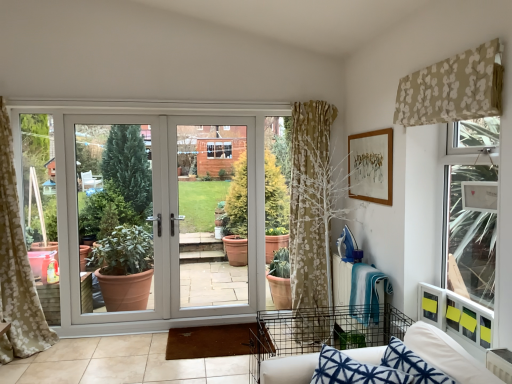
Identify the location of white plastic door at center. This screenshot has width=512, height=384. (163, 214).

What do you see at coordinates (452, 89) in the screenshot?
I see `beige floral fabric at upper right` at bounding box center [452, 89].

Where is `white glossy door at center`? The height and width of the screenshot is (384, 512). white glossy door at center is located at coordinates (211, 215).

Is point (451, 65) in front of point (103, 213)?

That is True.

Looking at this image, considering the sizes of beige floral fabric at upper right and white plastic door at center in the image, is beige floral fabric at upper right taller or shorter than white plastic door at center?

Considering their sizes, beige floral fabric at upper right has less height than white plastic door at center.

Looking at this image, is beige floral fabric at upper right to the left or to the right of white plastic door at center in the image?

Clearly, beige floral fabric at upper right is on the right of white plastic door at center in the image.

Between beige floral fabric at upper right and white plastic door at center, which one is positioned behind?

white plastic door at center is further away from the camera.

Are white glossy door at center and beige floral fabric at upper right beside each other?

No, white glossy door at center is not next to beige floral fabric at upper right.

How many degrees apart are the facing directions of white glossy door at center and beige floral fabric at upper right?

The facing directions of white glossy door at center and beige floral fabric at upper right are 89.2 degrees apart.

Between white glossy door at center and beige floral fabric at upper right, which one has larger size?

white glossy door at center.

From a real-world perspective, is white glossy door at center located higher than beige floral fabric at upper right?

No, from a real-world perspective, white glossy door at center is not above beige floral fabric at upper right.

From the picture: What's the angular difference between white plastic door at center and beige floral fabric at upper right's facing directions?

89.2 degrees separate the facing orientations of white plastic door at center and beige floral fabric at upper right.

From a real-world perspective, is white plastic door at center on beige floral fabric at upper right?

No, from a real-world perspective, white plastic door at center is not on top of beige floral fabric at upper right.

Is white plastic door at center wider or thinner than beige floral fabric at upper right?

white plastic door at center is thinner than beige floral fabric at upper right.

Is white plastic door at center inside or outside of beige floral fabric at upper right?

The correct answer is: outside.

Is beige floral fabric at upper right turned away from blue printed fabric couch at lower right?

No, blue printed fabric couch at lower right is not at the back of beige floral fabric at upper right.

Does point (490, 55) lie behind point (347, 352)?

No, (490, 55) is closer to viewer.

Which is correct: beige floral fabric at upper right is inside blue printed fabric couch at lower right, or outside of it?

beige floral fabric at upper right is located beyond the bounds of blue printed fabric couch at lower right.

Consider the image. Considering the positions of objects beige floral fabric at upper right and blue printed fabric couch at lower right in the image provided, who is more to the left, beige floral fabric at upper right or blue printed fabric couch at lower right?

blue printed fabric couch at lower right is more to the left.

Does white glossy door at center appear on the left side of white plastic door at center?

No, white glossy door at center is not to the left of white plastic door at center.

From a real-world perspective, who is located lower, white glossy door at center or white plastic door at center?

white plastic door at center, from a real-world perspective.

Can you confirm if white glossy door at center is bigger than white plastic door at center?

No, white glossy door at center is not bigger than white plastic door at center.

The image size is (512, 384). Find the location of `screen door above the white plastic door at center (from a real-world perspective)`. screen door above the white plastic door at center (from a real-world perspective) is located at coordinates (211, 215).

Considering the relative sizes of blue printed fabric couch at lower right and beige floral fabric at upper right in the image provided, is blue printed fabric couch at lower right bigger than beige floral fabric at upper right?

Indeed, blue printed fabric couch at lower right has a larger size compared to beige floral fabric at upper right.

How much distance is there between blue printed fabric couch at lower right and beige floral fabric at upper right?

They are 1.22 meters apart.

The image size is (512, 384). I want to click on couch in front of the beige floral fabric at upper right, so click(447, 355).

From the picture: What's the angular difference between blue printed fabric couch at lower right and beige floral fabric at upper right's facing directions?

There is a 29.8-degree angle between the facing directions of blue printed fabric couch at lower right and beige floral fabric at upper right.

Can we say beige floral fabric at upper right lies outside white glossy door at center?

Absolutely, beige floral fabric at upper right is external to white glossy door at center.

Considering the relative positions of beige floral fabric at upper right and white glossy door at center in the image provided, is beige floral fabric at upper right to the right of white glossy door at center from the viewer's perspective?

Correct, you'll find beige floral fabric at upper right to the right of white glossy door at center.

From a real-world perspective, which object rests below the other?

white glossy door at center.

I want to click on door below the beige floral fabric at upper right (from the image's perspective), so click(x=163, y=214).

At what (x,y) coordinates should I click in order to perform the action: click on curtain that appears in front of the white glossy door at center. Please return your answer as a coordinate pair (x, y). Looking at the image, I should click on (452, 89).

Estimate the real-world distances between objects in this image. Which object is further from white glossy door at center, white plastic door at center or beige floral fabric at upper right?

beige floral fabric at upper right lies further to white glossy door at center than the other object.

Looking at the image, which one is located closer to white glossy door at center, blue printed fabric couch at lower right or white plastic door at center?

The object closer to white glossy door at center is white plastic door at center.

Estimate the real-world distances between objects in this image. Which object is further from beige floral fabric at upper right, blue printed fabric couch at lower right or white glossy door at center?

The object further to beige floral fabric at upper right is white glossy door at center.

Which object lies nearer to the anchor point white glossy door at center, beige floral fabric at upper right or white plastic door at center?

white plastic door at center lies closer to white glossy door at center than the other object.

Estimate the real-world distances between objects in this image. Which object is further from blue printed fabric couch at lower right, beige floral fabric at upper right or white glossy door at center?

white glossy door at center lies further to blue printed fabric couch at lower right than the other object.

Which object lies further to the anchor point beige floral fabric at upper right, white glossy door at center or white plastic door at center?

white plastic door at center.

From the image, which object appears to be nearer to blue printed fabric couch at lower right, white glossy door at center or white plastic door at center?

white glossy door at center is closer to blue printed fabric couch at lower right.

Which object lies further to the anchor point white plastic door at center, beige floral fabric at upper right or white glossy door at center?

Among the two, beige floral fabric at upper right is located further to white plastic door at center.

Where is `curtain between blue printed fabric couch at lower right and white plastic door at center along the z-axis`? Image resolution: width=512 pixels, height=384 pixels. curtain between blue printed fabric couch at lower right and white plastic door at center along the z-axis is located at coordinates tap(452, 89).

This screenshot has width=512, height=384. In order to click on door between blue printed fabric couch at lower right and white glossy door at center from front to back in this screenshot , I will do `click(163, 214)`.

Image resolution: width=512 pixels, height=384 pixels. I want to click on door positioned between beige floral fabric at upper right and white glossy door at center from near to far, so click(163, 214).

Identify the location of curtain located between blue printed fabric couch at lower right and white glossy door at center in the depth direction. The width and height of the screenshot is (512, 384). (452, 89).